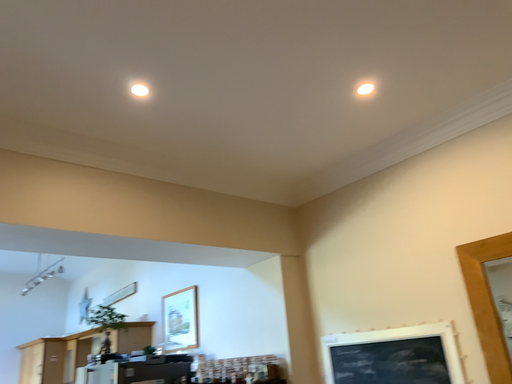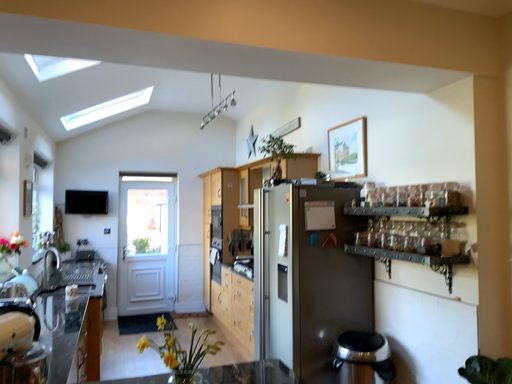
Question: How did the camera likely rotate when shooting the video?

Choices:
 (A) rotated right
 (B) rotated left

Answer: (B)